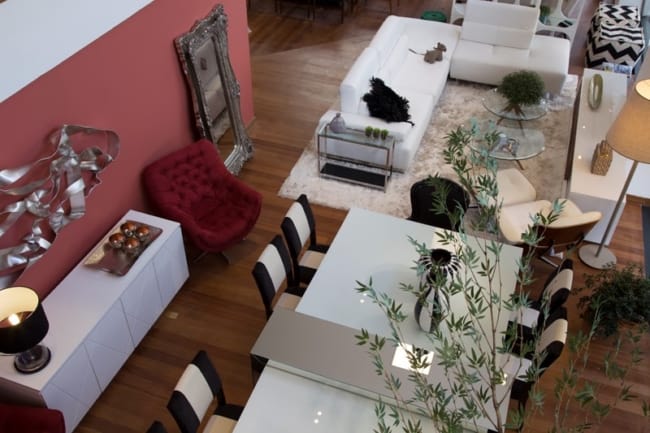
This screenshot has height=433, width=650. Identify the location of brown/red chair. (224, 232).